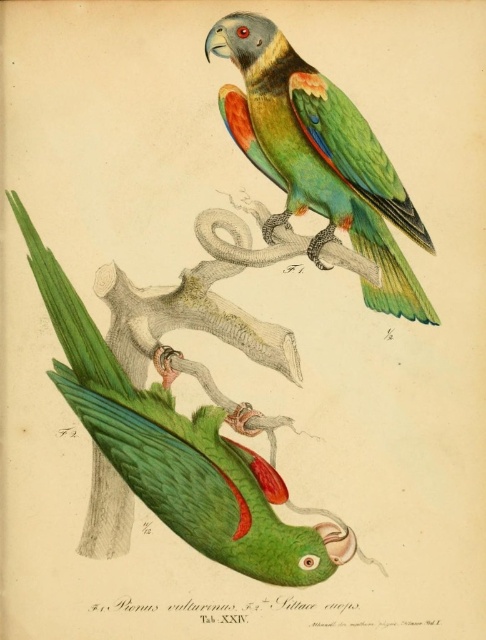
Question: Is the position of green matte parrot at lower left less distant than that of green matte parrot at center?

Choices:
 (A) yes
 (B) no

Answer: (A)

Question: Does green matte parrot at lower left have a larger size compared to green matte parrot at center?

Choices:
 (A) yes
 (B) no

Answer: (A)

Question: Does green matte parrot at lower left appear on the right side of green matte parrot at center?

Choices:
 (A) no
 (B) yes

Answer: (A)

Question: Which object is closer to the camera taking this photo?

Choices:
 (A) green matte parrot at lower left
 (B) green matte parrot at center

Answer: (A)

Question: Which point is farther from the camera taking this photo?

Choices:
 (A) (384, 273)
 (B) (86, 349)

Answer: (A)

Question: Which point is farther to the camera?

Choices:
 (A) [416, 212]
 (B) [163, 424]

Answer: (A)